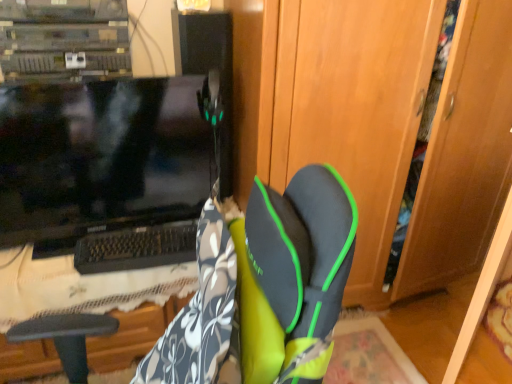
Question: Is black glossy monitor at left to the left of wooden dresser at center from the viewer's perspective?

Choices:
 (A) no
 (B) yes

Answer: (B)

Question: From a real-world perspective, is black glossy monitor at left located beneath wooden dresser at center?

Choices:
 (A) yes
 (B) no

Answer: (B)

Question: Is wooden dresser at center at the back of black glossy monitor at left?

Choices:
 (A) yes
 (B) no

Answer: (B)

Question: Is black glossy monitor at left not near wooden dresser at center?

Choices:
 (A) no
 (B) yes

Answer: (A)

Question: Is black glossy monitor at left shorter than wooden dresser at center?

Choices:
 (A) no
 (B) yes

Answer: (B)

Question: Does black glossy monitor at left have a smaller size compared to wooden dresser at center?

Choices:
 (A) yes
 (B) no

Answer: (A)

Question: Considering the relative sizes of wooden dresser at center and black glossy monitor at left in the image provided, is wooden dresser at center shorter than black glossy monitor at left?

Choices:
 (A) no
 (B) yes

Answer: (A)

Question: Can you confirm if wooden dresser at center is smaller than black glossy monitor at left?

Choices:
 (A) no
 (B) yes

Answer: (A)

Question: Is wooden dresser at center further to the viewer compared to black glossy monitor at left?

Choices:
 (A) yes
 (B) no

Answer: (B)

Question: Would you say wooden dresser at center is a long distance from black glossy monitor at left?

Choices:
 (A) yes
 (B) no

Answer: (B)

Question: Does wooden dresser at center have a larger size compared to black glossy monitor at left?

Choices:
 (A) yes
 (B) no

Answer: (A)

Question: From a real-world perspective, is wooden dresser at center physically below black glossy monitor at left?

Choices:
 (A) no
 (B) yes

Answer: (B)

Question: From a real-world perspective, is black glossy monitor at left positioned above or below wooden dresser at center?

Choices:
 (A) above
 (B) below

Answer: (A)